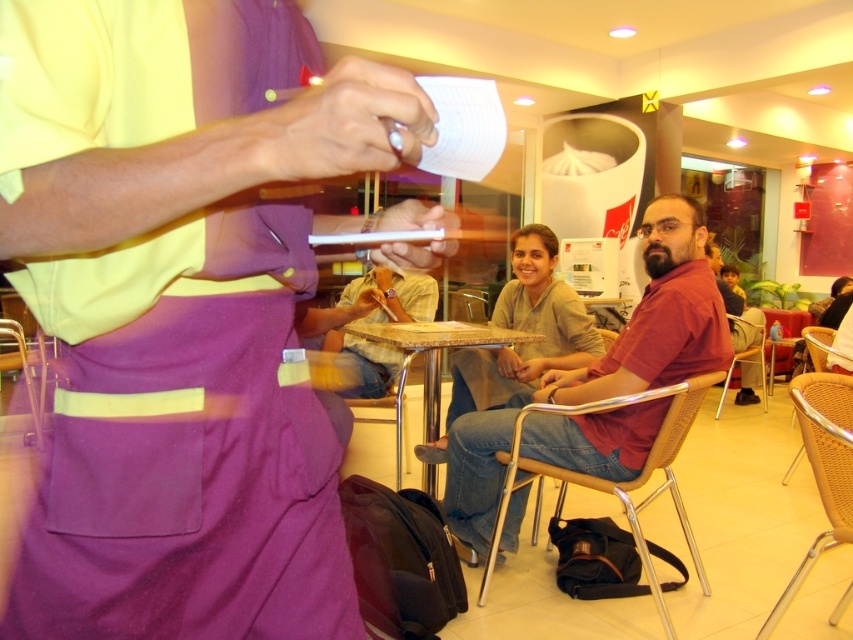
You are a customer in the dining establishment and you see the point at coordinates (x=657, y=316). What object is this point located on?

The point at coordinates (x=657, y=316) is located on the matte red shirt at center.